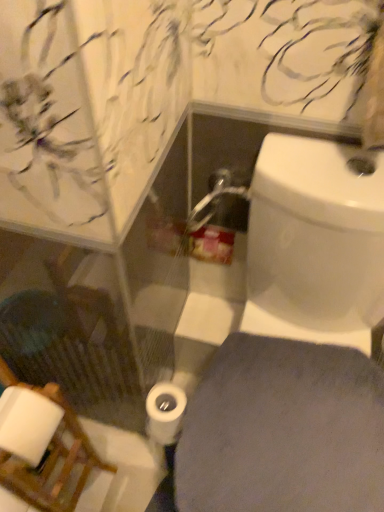
Question: Is white matte toilet paper at center positioned with its back to wooden chair at lower left?

Choices:
 (A) yes
 (B) no

Answer: (B)

Question: Can you confirm if white matte toilet paper at center is shorter than wooden chair at lower left?

Choices:
 (A) no
 (B) yes

Answer: (B)

Question: Can you see white matte toilet paper at center touching wooden chair at lower left?

Choices:
 (A) no
 (B) yes

Answer: (A)

Question: Can you confirm if white matte toilet paper at center is positioned to the left of wooden chair at lower left?

Choices:
 (A) no
 (B) yes

Answer: (A)

Question: Is white matte toilet paper at center not close to wooden chair at lower left?

Choices:
 (A) yes
 (B) no

Answer: (B)

Question: Visually, is white matte toilet paper at center positioned to the left or to the right of white glossy toilet at lower right?

Choices:
 (A) left
 (B) right

Answer: (A)

Question: From a real-world perspective, is white matte toilet paper at center above or below white glossy toilet at lower right?

Choices:
 (A) below
 (B) above

Answer: (A)

Question: Is white matte toilet paper at center wider or thinner than white glossy toilet at lower right?

Choices:
 (A) thin
 (B) wide

Answer: (A)

Question: Considering the positions of point (157, 391) and point (210, 439), is point (157, 391) closer or farther from the camera than point (210, 439)?

Choices:
 (A) farther
 (B) closer

Answer: (A)

Question: Which is correct: wooden chair at lower left is inside white matte toilet paper at center, or outside of it?

Choices:
 (A) outside
 (B) inside

Answer: (A)

Question: From a real-world perspective, is wooden chair at lower left positioned above or below white matte toilet paper at center?

Choices:
 (A) below
 (B) above

Answer: (A)

Question: Is wooden chair at lower left taller or shorter than white matte toilet paper at center?

Choices:
 (A) short
 (B) tall

Answer: (B)

Question: In terms of width, does wooden chair at lower left look wider or thinner when compared to white matte toilet paper at center?

Choices:
 (A) wide
 (B) thin

Answer: (A)

Question: From the image's perspective, relative to white matte toilet paper at center, is white glossy toilet at lower right above or below?

Choices:
 (A) below
 (B) above

Answer: (B)

Question: Which is correct: white glossy toilet at lower right is inside white matte toilet paper at center, or outside of it?

Choices:
 (A) inside
 (B) outside

Answer: (B)